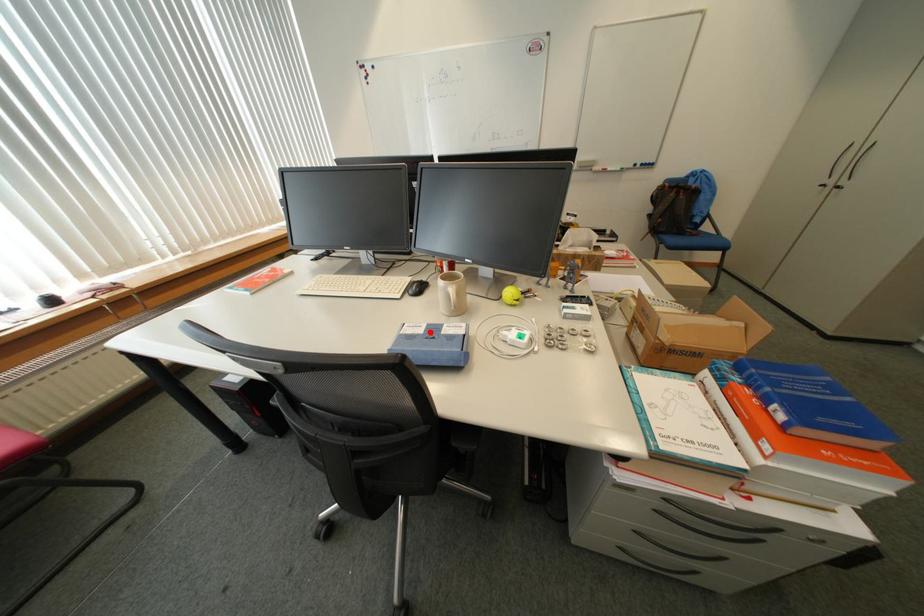
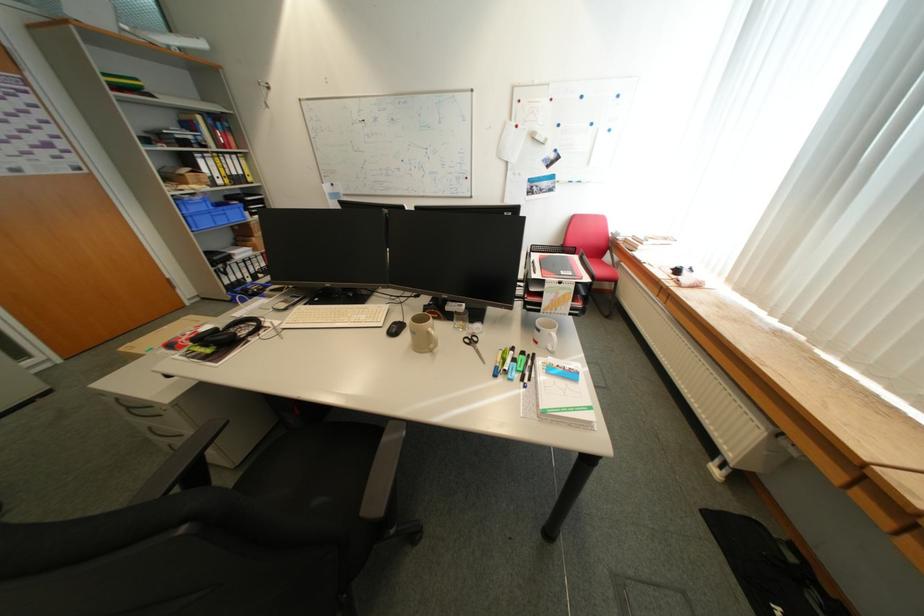
Question: I am providing you with two images of the same scene from different viewpoints. A red point is marked on the first image. Is the red point's position out of view in image 2?

Choices:
 (A) Yes
 (B) No

Answer: (A)